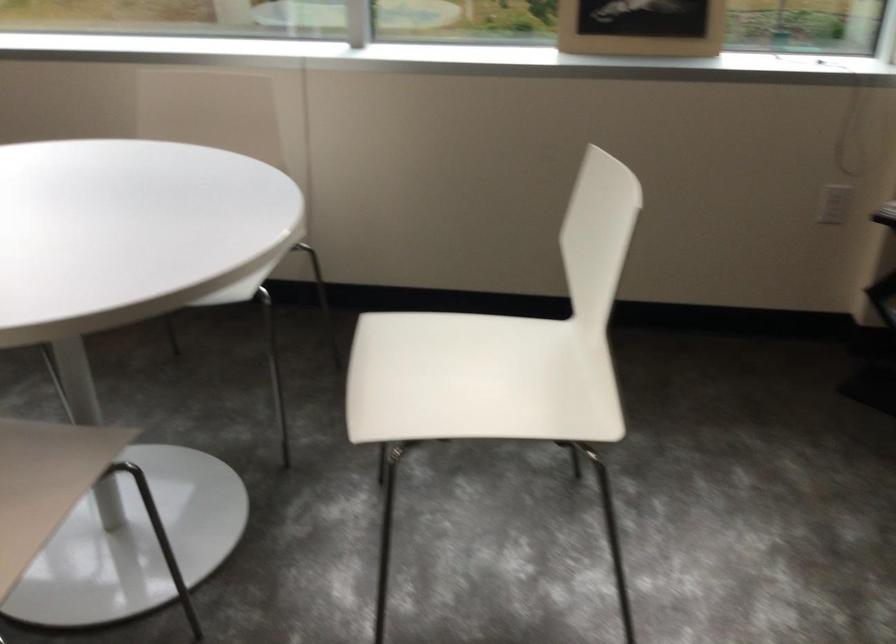
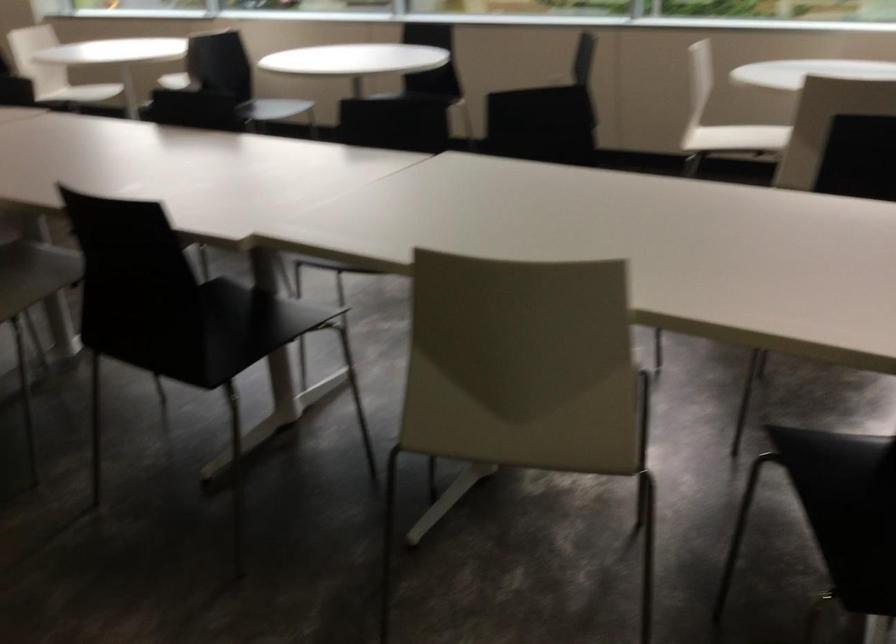
What movement of the cameraman would produce the second image?

The movement direction of the cameraman is left, backward.